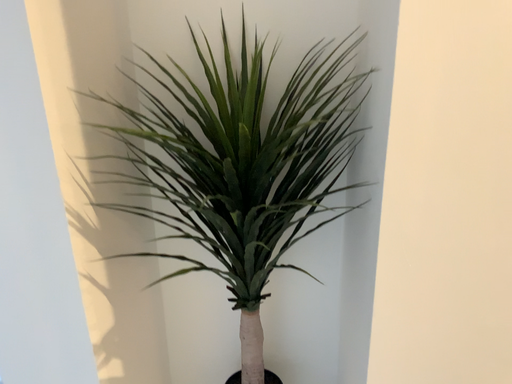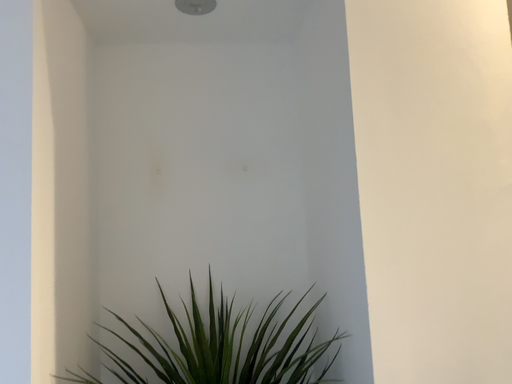
Question: Which way did the camera rotate in the video?

Choices:
 (A) rotated upward
 (B) rotated downward

Answer: (A)